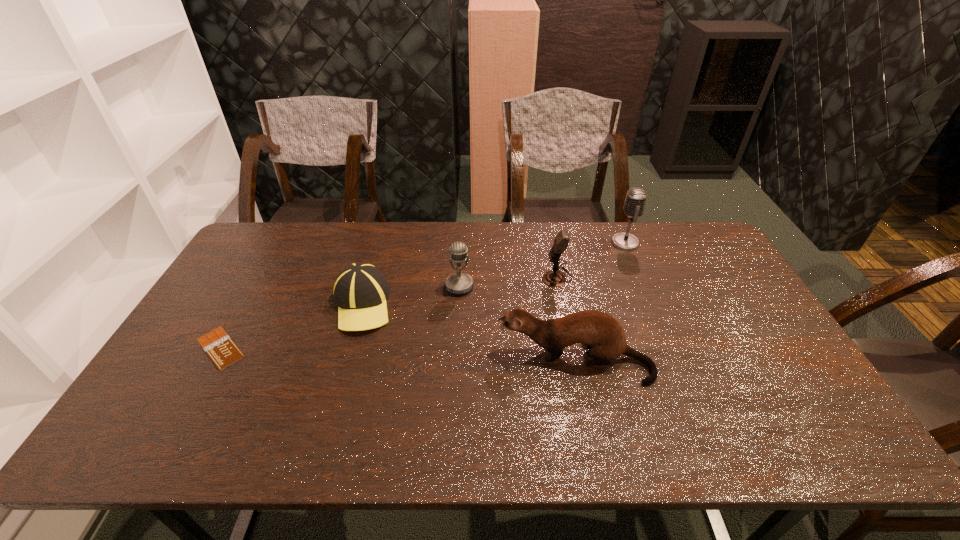
This screenshot has width=960, height=540. I want to click on the rightmost object, so click(x=636, y=198).

Identify the location of the farthest microphone. The height and width of the screenshot is (540, 960). (636, 198).

Image resolution: width=960 pixels, height=540 pixels. In order to click on the second microphone from right to left in this screenshot , I will do `click(553, 278)`.

You are a GUI agent. You are given a task and a screenshot of the screen. Output one action in this format:
    pyautogui.click(x=<x>, y=<y>)
    Task: Click on the third object from left to right
    This screenshot has height=540, width=960.
    Given the screenshot: What is the action you would take?
    pyautogui.click(x=458, y=283)

Where is `ferret`? This screenshot has width=960, height=540. ferret is located at coordinates (592, 328).

You are a GUI agent. You are given a task and a screenshot of the screen. Output one action in this format:
    pyautogui.click(x=<x>, y=<y>)
    Task: Click on the second object from left to right
    The image size is (960, 540).
    Given the screenshot: What is the action you would take?
    pyautogui.click(x=360, y=291)

The width and height of the screenshot is (960, 540). What are the coordinates of `the fifth tallest object` in the screenshot? It's located at point(360,291).

Find the location of a particular element. The width and height of the screenshot is (960, 540). the leftmost object is located at coordinates (222, 350).

Where is `chocolate bar`? Image resolution: width=960 pixels, height=540 pixels. chocolate bar is located at coordinates (222, 350).

At what (x,y) coordinates should I click in order to perform the action: click on vacant area situated 0.320m on the left of the tallest microphone. Please return your answer as a coordinate pair (x, y). The image size is (960, 540). Looking at the image, I should click on (521, 242).